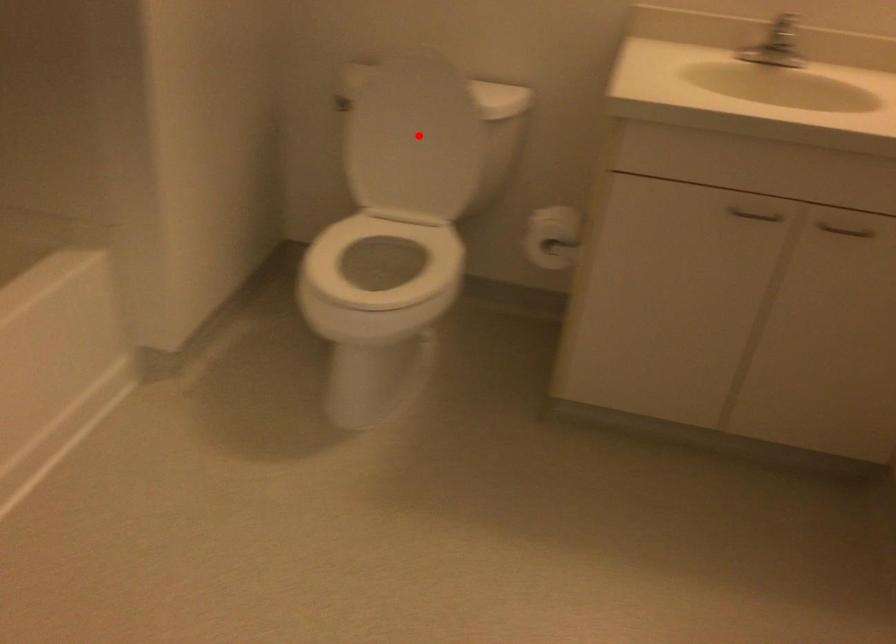
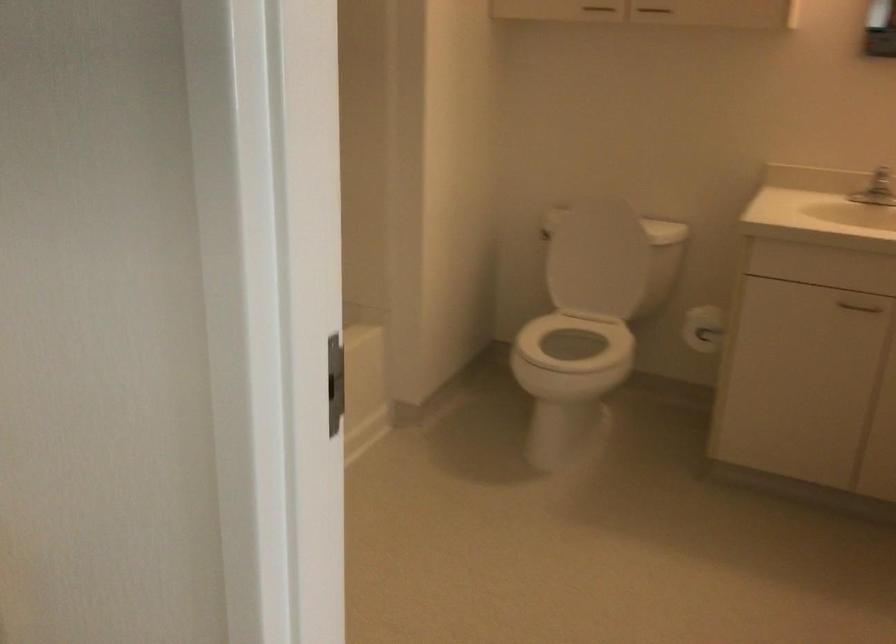
The point at the highlighted location is marked in the first image. Where is the corresponding point in the second image?

(596, 258)